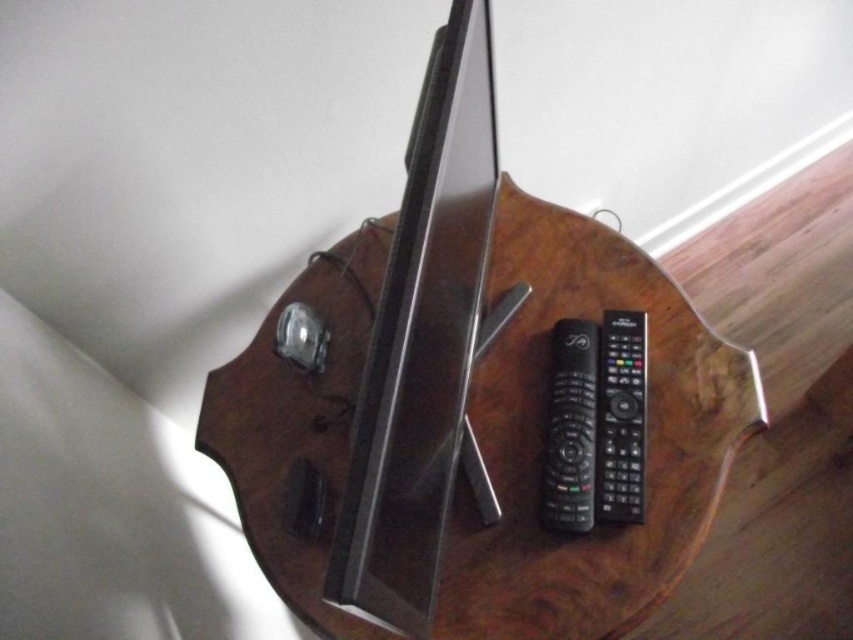
Question: Estimate the real-world distances between objects in this image. Which object is closer to the wooden table at center?

Choices:
 (A) black plastic remote at center
 (B) black plastic remote at right

Answer: (A)

Question: Is wooden table at center above black plastic remote at right?

Choices:
 (A) no
 (B) yes

Answer: (B)

Question: Can you confirm if wooden table at center is smaller than black plastic remote at center?

Choices:
 (A) yes
 (B) no

Answer: (B)

Question: Which point is closer to the camera?

Choices:
 (A) (631, 342)
 (B) (578, 387)
 (C) (514, 433)

Answer: (B)

Question: Which of these objects is positioned farthest from the wooden table at center?

Choices:
 (A) black plastic remote at center
 (B) black plastic remote at right

Answer: (B)

Question: Does black plastic remote at center have a larger size compared to black plastic remote at right?

Choices:
 (A) no
 (B) yes

Answer: (B)